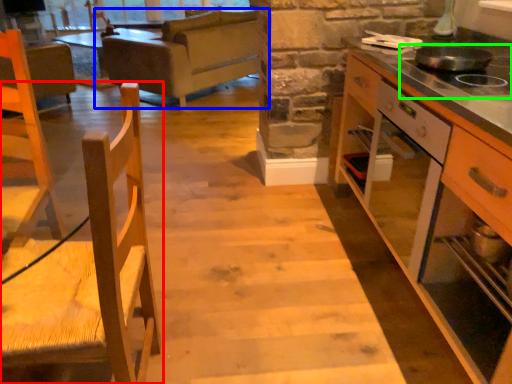
Question: Based on their relative distances, which object is farther from chair (highlighted by a red box)? Choose from studio couch (highlighted by a blue box) and gas stove (highlighted by a green box).

Choices:
 (A) studio couch
 (B) gas stove

Answer: (A)